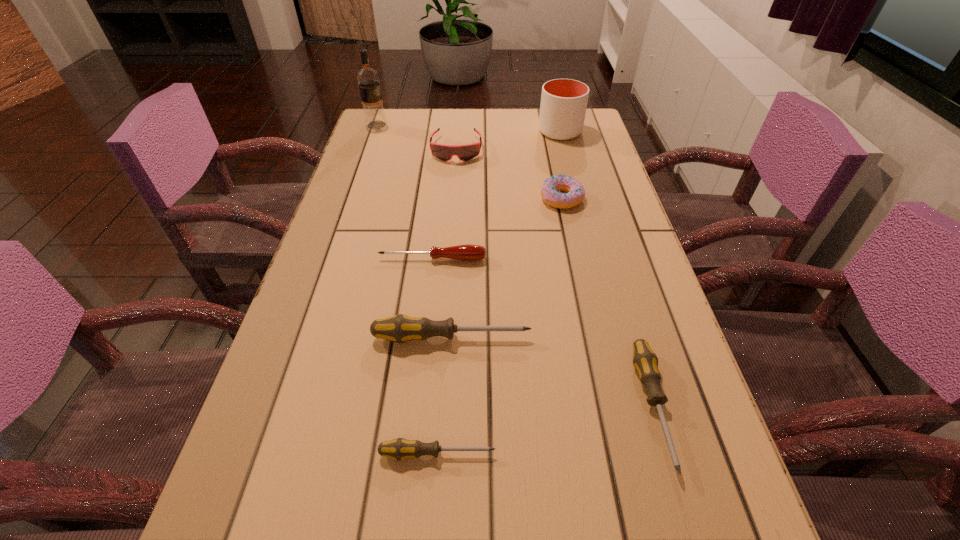
Locate an element on the screen. the farthest screwdriver is located at coordinates (469, 252).

Find the location of a particular element. Image resolution: width=960 pixels, height=540 pixels. the fourth nearest object is located at coordinates (469, 252).

You are a GUI agent. You are given a task and a screenshot of the screen. Output one action in this format:
    pyautogui.click(x=<x>, y=<y>)
    Task: Click on the shortest screwdriver
    
    Given the screenshot: What is the action you would take?
    pyautogui.click(x=400, y=448)

The image size is (960, 540). Identify the location of the shortest object. (400, 448).

Image resolution: width=960 pixels, height=540 pixels. What are the coordinates of `vacant region located on the label of the vodka` in the screenshot? It's located at (437, 125).

In order to click on vacant area situated on the left of the second tallest object in this screenshot , I will do [452, 132].

I want to click on vacant region located 0.050m on the front-facing side of the pink goggles, so click(x=454, y=173).

Where is `vacant space situated at the tip of the biggest gray screwdriver`? The image size is (960, 540). vacant space situated at the tip of the biggest gray screwdriver is located at coordinates (662, 337).

The width and height of the screenshot is (960, 540). Identify the location of vacant space located 0.130m on the back of the fifth nearest object. (554, 160).

Find the location of `vacant space situated on the back of the farthest screwdriver`. vacant space situated on the back of the farthest screwdriver is located at coordinates (442, 177).